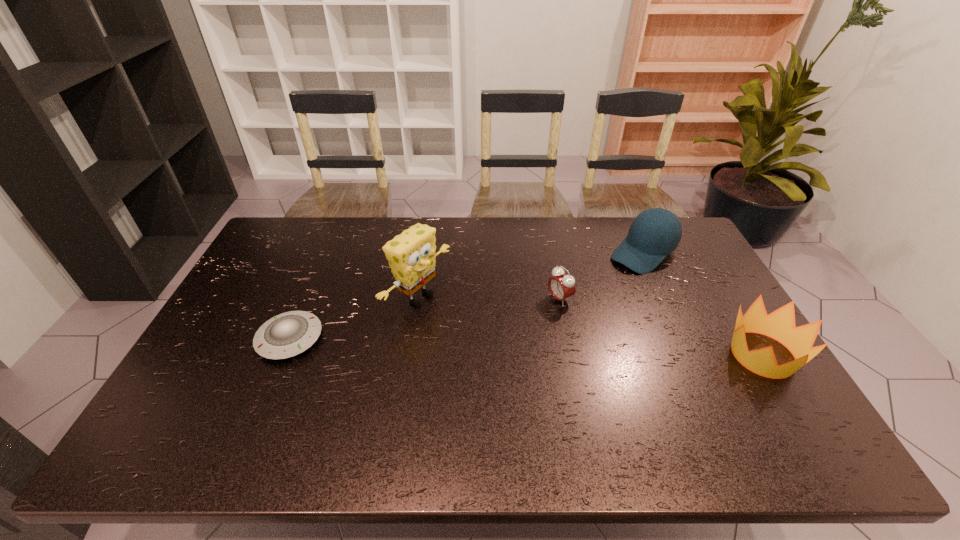
The image size is (960, 540). What are the coordinates of `saucer` in the screenshot? It's located at (286, 335).

Identify the location of the shortest object. (286, 335).

At what (x,y) coordinates should I click in order to perform the action: click on crown. Please return your answer as a coordinate pair (x, y). This screenshot has height=540, width=960. Looking at the image, I should click on (780, 325).

At what (x,y) coordinates should I click in order to perform the action: click on alarm clock. Please return your answer as a coordinate pair (x, y). The image size is (960, 540). Looking at the image, I should click on (562, 286).

Identify the location of the second object from left to right. (411, 255).

Locate an element on the screen. the tallest object is located at coordinates 411,255.

Locate an element on the screen. the second tallest object is located at coordinates (656, 232).

Where is `free region located 0.350m on the right of the shortest object`? This screenshot has height=540, width=960. free region located 0.350m on the right of the shortest object is located at coordinates (447, 339).

The width and height of the screenshot is (960, 540). In order to click on vacant space positioned 0.210m on the back of the crown in this screenshot , I will do `click(716, 279)`.

At what (x,y) coordinates should I click in order to perform the action: click on free region located 0.120m on the clock face of the third object from left to right. Please return your answer as a coordinate pair (x, y). This screenshot has width=960, height=540. Looking at the image, I should click on (518, 320).